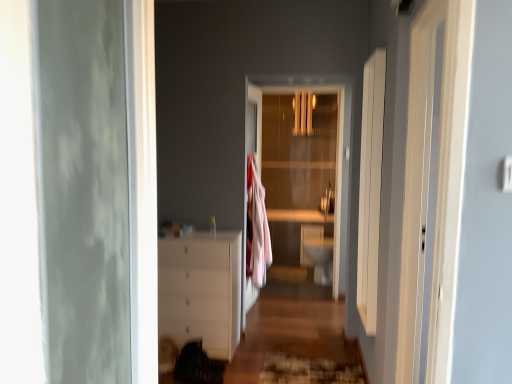
Locate an element on the screen. vacant space in transparent glass door at center (from a real-world perspective) is located at coordinates (291, 289).